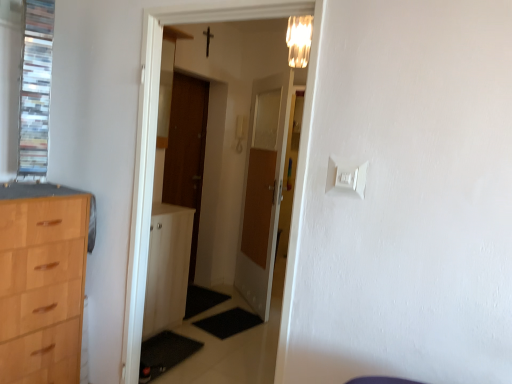
Question: Considering the positions of metallic cross at upper center and white plastic light switch at upper center in the image, is metallic cross at upper center bigger or smaller than white plastic light switch at upper center?

Choices:
 (A) big
 (B) small

Answer: (B)

Question: Based on their positions, is metallic cross at upper center located to the left or right of white plastic light switch at upper center?

Choices:
 (A) right
 (B) left

Answer: (B)

Question: Considering the real-world distances, which object is farthest from the black rubber mat at lower center?

Choices:
 (A) white glossy door at center
 (B) metallic cross at upper center
 (C) clear glass window at upper left
 (D) white glossy cabinet at center
 (E) wooden door at center, the first door from the left

Answer: (B)

Question: Which object is the closest to the clear glass window at upper left?

Choices:
 (A) white glossy cabinet at center
 (B) black rubber mat at lower center
 (C) metallic cross at upper center
 (D) white glossy door at center
 (E) wooden door at center, the 2th door in the right-to-left sequence

Answer: (D)